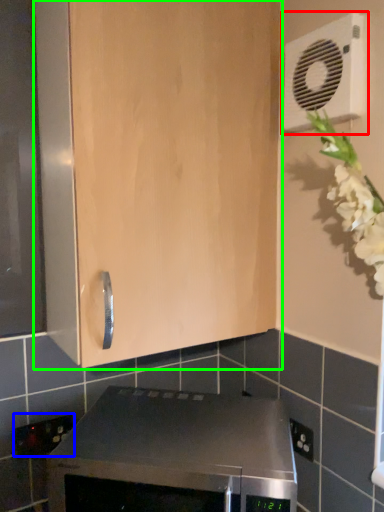
Question: Which object is positioned closest to air conditioning (highlighted by a red box)? Select from electric outlet (highlighted by a blue box) and cabinetry (highlighted by a green box).

Choices:
 (A) electric outlet
 (B) cabinetry

Answer: (B)